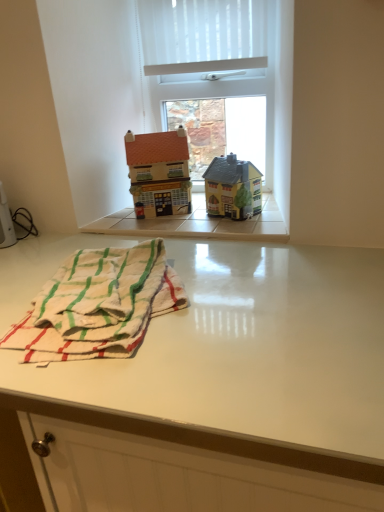
The height and width of the screenshot is (512, 384). Find the location of `white glossy table at lower center`. white glossy table at lower center is located at coordinates (225, 392).

What do you see at coordinates (159, 172) in the screenshot? I see `matte brown house at center, placed as the 1th toy when sorted from left to right` at bounding box center [159, 172].

The height and width of the screenshot is (512, 384). What do you see at coordinates (98, 305) in the screenshot? I see `white woven beach towel at lower left` at bounding box center [98, 305].

Measure the distance between point (163, 19) and camera.

Point (163, 19) is 4.13 feet away from camera.

Locate an element on the screen. The height and width of the screenshot is (512, 384). white glossy table at lower center is located at coordinates (225, 392).

Between matte brown house at center, placed as the 1th toy when sorted from left to right, and white woven beach towel at lower left, which one has less height?

white woven beach towel at lower left is shorter.

Could you tell me if matte brown house at center, marked as the 2th toy in a right-to-left arrangement, is facing white woven beach towel at lower left?

Yes, matte brown house at center, marked as the 2th toy in a right-to-left arrangement, is aimed at white woven beach towel at lower left.

Does matte brown house at center, marked as the 2th toy in a right-to-left arrangement, have a larger size compared to white woven beach towel at lower left?

No.

From a real-world perspective, who is located lower, matte brown house at center, marked as the 2th toy in a right-to-left arrangement, or white woven beach towel at lower left?

white woven beach towel at lower left.

Is white glossy table at lower center situated inside matte brown house at center, placed as the 1th toy when sorted from left to right, or outside?

white glossy table at lower center is spatially situated outside matte brown house at center, placed as the 1th toy when sorted from left to right.

Could you tell me if white glossy table at lower center is turned towards matte brown house at center, marked as the 2th toy in a right-to-left arrangement?

No.

From their relative heights in the image, would you say white glossy table at lower center is taller or shorter than matte brown house at center, marked as the 2th toy in a right-to-left arrangement?

Considering their sizes, white glossy table at lower center has more height than matte brown house at center, marked as the 2th toy in a right-to-left arrangement.

Considering the positions of point (266, 383) and point (151, 207), is point (266, 383) closer or farther from the camera than point (151, 207)?

Point (266, 383) appears to be closer to the viewer than point (151, 207).

Considering the sizes of objects white woven beach towel at lower left and matte brown house at center, placed as the 1th toy when sorted from left to right, in the image provided, who is bigger, white woven beach towel at lower left or matte brown house at center, placed as the 1th toy when sorted from left to right,?

white woven beach towel at lower left.

Can you confirm if white woven beach towel at lower left is shorter than matte brown house at center, marked as the 2th toy in a right-to-left arrangement?

Yes.

Is white woven beach towel at lower left placed right next to matte brown house at center, placed as the 1th toy when sorted from left to right?

white woven beach towel at lower left and matte brown house at center, placed as the 1th toy when sorted from left to right, are not in contact.

From a real-world perspective, is white woven beach towel at lower left over matte brown house at center, marked as the 2th toy in a right-to-left arrangement?

No, from a real-world perspective, white woven beach towel at lower left is not above matte brown house at center, marked as the 2th toy in a right-to-left arrangement.

Does point (126, 257) come farther from viewer compared to point (259, 207)?

That is False.

Is white woven beach towel at lower left facing towards yellow matte house at center, the 1th toy from the right?

No.

What's the angular difference between white woven beach towel at lower left and yellow matte house at center, the 1th toy from the right,'s facing directions?

33.2 degrees separate the facing orientations of white woven beach towel at lower left and yellow matte house at center, the 1th toy from the right.

Considering the sizes of objects white woven beach towel at lower left and yellow matte house at center, the 1th toy from the right, in the image provided, who is smaller, white woven beach towel at lower left or yellow matte house at center, the 1th toy from the right,?

yellow matte house at center, the 1th toy from the right.

From the image's perspective, between white glossy table at lower center and white woven beach towel at lower left, which one is located above?

white woven beach towel at lower left, from the image's perspective.

Is white glossy table at lower center oriented towards white woven beach towel at lower left?

No, white glossy table at lower center is not oriented towards white woven beach towel at lower left.

Can you confirm if white woven beach towel at lower left is smaller than white glossy table at lower center?

Correct, white woven beach towel at lower left occupies less space than white glossy table at lower center.

Does white woven beach towel at lower left come in front of white glossy table at lower center?

No, the depth of white woven beach towel at lower left is greater than that of white glossy table at lower center.

From the picture: From the image's perspective, does white woven beach towel at lower left appear lower than white glossy table at lower center?

No, from the image's perspective, white woven beach towel at lower left is not beneath white glossy table at lower center.

Which object is thinner, yellow matte house at center, the 1th toy from the right, or white plastic window at upper center?

With smaller width is white plastic window at upper center.

Image resolution: width=384 pixels, height=512 pixels. In order to click on toy lying on the right of white plastic window at upper center in this screenshot , I will do `click(233, 188)`.

From a real-world perspective, is yellow matte house at center, which is counted as the second toy, starting from the left, above or below white plastic window at upper center?

In terms of real-world spatial position, yellow matte house at center, which is counted as the second toy, starting from the left, is below white plastic window at upper center.

Consider the image. Who is bigger, yellow matte house at center, the 1th toy from the right, or white plastic window at upper center?

white plastic window at upper center.

This screenshot has height=512, width=384. What are the coordinates of `beach towel below the matte brown house at center, placed as the 1th toy when sorted from left to right (from the image's perspective)` in the screenshot? It's located at (98, 305).

From the image's perspective, count 2nd toys upward from the white glossy table at lower center and point to it. Please provide its 2D coordinates.

[(159, 172)]

Looking at this image, when comparing their distances from matte brown house at center, marked as the 2th toy in a right-to-left arrangement, does white glossy table at lower center or white plastic window at upper center seem closer?

Based on the image, white plastic window at upper center appears to be nearer to matte brown house at center, marked as the 2th toy in a right-to-left arrangement.

Considering their positions, is white glossy table at lower center positioned further to white woven beach towel at lower left than yellow matte house at center, which is counted as the second toy, starting from the left?

The object further to white woven beach towel at lower left is yellow matte house at center, which is counted as the second toy, starting from the left.

From the image, which object appears to be farther from white plastic window at upper center, yellow matte house at center, which is counted as the second toy, starting from the left, or white woven beach towel at lower left?

white woven beach towel at lower left is further to white plastic window at upper center.

Estimate the real-world distances between objects in this image. Which object is further from white plastic window at upper center, matte brown house at center, marked as the 2th toy in a right-to-left arrangement, or white glossy table at lower center?

white glossy table at lower center.

From the image, which object appears to be farther from white woven beach towel at lower left, yellow matte house at center, the 1th toy from the right, or white plastic window at upper center?

white plastic window at upper center.

Estimate the real-world distances between objects in this image. Which object is closer to white woven beach towel at lower left, yellow matte house at center, the 1th toy from the right, or white glossy table at lower center?

white glossy table at lower center is positioned closer to the anchor white woven beach towel at lower left.

Estimate the real-world distances between objects in this image. Which object is further from matte brown house at center, placed as the 1th toy when sorted from left to right, white plastic window at upper center or white glossy table at lower center?

white glossy table at lower center.

Which object lies nearer to the anchor point white plastic window at upper center, yellow matte house at center, which is counted as the second toy, starting from the left, or white glossy table at lower center?

yellow matte house at center, which is counted as the second toy, starting from the left.

Where is `window located between white woven beach towel at lower left and matte brown house at center, placed as the 1th toy when sorted from left to right, in the depth direction`? window located between white woven beach towel at lower left and matte brown house at center, placed as the 1th toy when sorted from left to right, in the depth direction is located at coordinates coord(225,64).

Find the location of a particular element. The height and width of the screenshot is (512, 384). toy between white plastic window at upper center and yellow matte house at center, the 1th toy from the right, from top to bottom is located at coordinates (159, 172).

In order to click on beach towel between white plastic window at upper center and white glossy table at lower center in the up-down direction in this screenshot , I will do `click(98, 305)`.

The image size is (384, 512). I want to click on toy between white woven beach towel at lower left and white plastic window at upper center from front to back, so click(x=233, y=188).